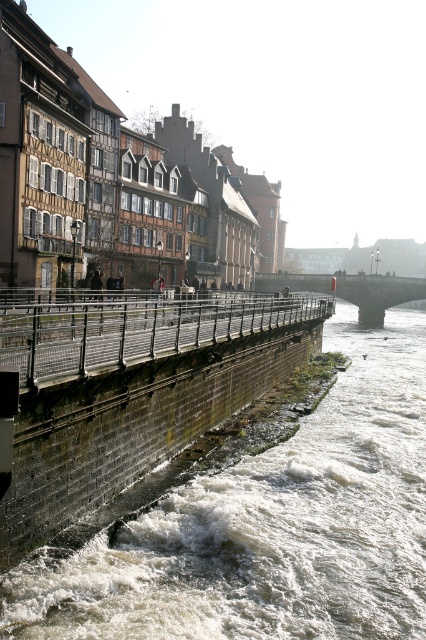
You are a tourist standing on the path above the rough concrete river at center and dark gray stone bridge at center. You want to take a photo of the river and the bridge. Which one should you point your camera down towards to capture both in the frame?

You should point your camera down towards the rough concrete river at center because it is lower than the dark gray stone bridge at center, allowing both to be in the frame.